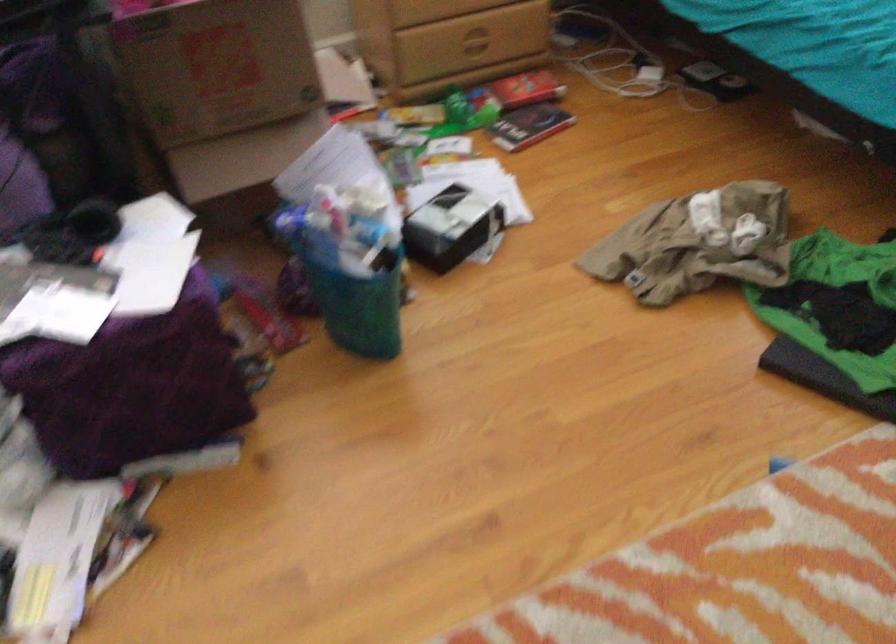
At what (x,y) coordinates should I click in order to perform the action: click on green mesh basket. Please return your answer as a coordinate pair (x, y). This screenshot has height=644, width=896. Looking at the image, I should click on (352, 299).